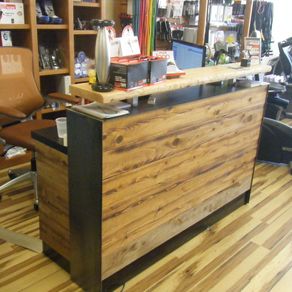
Locate an element on the screen. The height and width of the screenshot is (292, 292). chair is located at coordinates (28, 126).